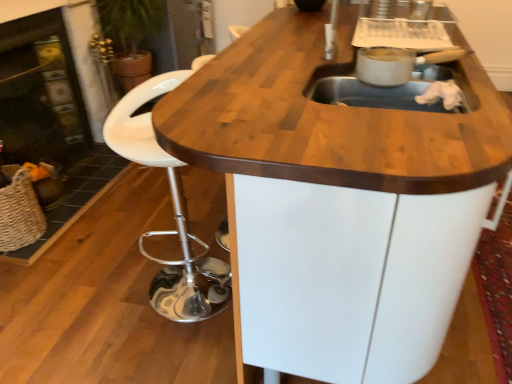
This screenshot has height=384, width=512. What do you see at coordinates (174, 211) in the screenshot?
I see `white plastic stool at lower left` at bounding box center [174, 211].

This screenshot has width=512, height=384. I want to click on woven straw basket at lower left, so click(19, 211).

This screenshot has height=384, width=512. I want to click on basket lying below the matte black fireplace at left, the 1th fireplace when ordered from left to right (from the image's perspective), so click(19, 211).

Consider the image. Is matte black fireplace at left, the 1th fireplace when ordered from left to right, facing towards woven straw basket at lower left?

No, matte black fireplace at left, the 1th fireplace when ordered from left to right, does not turn towards woven straw basket at lower left.

From their relative heights in the image, would you say matte black fireplace at left, the 1th fireplace when ordered from left to right, is taller or shorter than woven straw basket at lower left?

In the image, matte black fireplace at left, the 1th fireplace when ordered from left to right, appears to be taller than woven straw basket at lower left.

How different are the orientations of white plastic stool at lower left and woven straw basket at lower left in degrees?

The angular difference between white plastic stool at lower left and woven straw basket at lower left is 90 degrees.

Is white plastic stool at lower left bigger than woven straw basket at lower left?

Correct, white plastic stool at lower left is larger in size than woven straw basket at lower left.

Is point (199, 242) less distant than point (17, 216)?

No, it is behind (17, 216).

Is white plastic stool at lower left oriented away from woven straw basket at lower left?

No, white plastic stool at lower left is not facing the opposite direction of woven straw basket at lower left.

From the image's perspective, is white plastic stool at lower left over matte black fireplace at left, the 1th fireplace when ordered from left to right?

No, from the image's perspective, white plastic stool at lower left is not over matte black fireplace at left, the 1th fireplace when ordered from left to right.

Can you confirm if white plastic stool at lower left is thinner than matte black fireplace at left, the 1th fireplace when ordered from left to right?

No.

Which object is positioned more to the right, white plastic stool at lower left or matte black fireplace at left, the second fireplace viewed from the right?

→ From the viewer's perspective, white plastic stool at lower left appears more on the right side.

Would you say white plastic stool at lower left contains matte black fireplace at left, the second fireplace viewed from the right?

No, matte black fireplace at left, the second fireplace viewed from the right, is not surrounded by white plastic stool at lower left.

Considering the positions of point (172, 261) and point (60, 82), is point (172, 261) closer or farther from the camera than point (60, 82)?

Point (172, 261).

Which of these two, white plastic stool at lower left or black glass fireplace at left, positioned as the second fireplace in left-to-right order, stands shorter?

Standing shorter between the two is white plastic stool at lower left.

Find the location of `the 1st fireplace to the left when counting from the white plastic stool at lower left`. the 1st fireplace to the left when counting from the white plastic stool at lower left is located at coordinates (56, 111).

Which is behind, point (10, 209) or point (39, 149)?

Positioned behind is point (39, 149).

From the picture: Relative to matte black fireplace at left, the 1th fireplace when ordered from left to right, is woven straw basket at lower left in front or behind?

Clearly, woven straw basket at lower left is in front of matte black fireplace at left, the 1th fireplace when ordered from left to right.

Considering the relative sizes of woven straw basket at lower left and matte black fireplace at left, the second fireplace viewed from the right, in the image provided, is woven straw basket at lower left smaller than matte black fireplace at left, the second fireplace viewed from the right,?

Indeed, woven straw basket at lower left has a smaller size compared to matte black fireplace at left, the second fireplace viewed from the right.

Which of these two, woven straw basket at lower left or white plastic stool at lower left, stands taller?

white plastic stool at lower left is taller.

From a real-world perspective, between woven straw basket at lower left and white plastic stool at lower left, who is vertically lower?

From a 3D spatial view, woven straw basket at lower left is below.

Which point is more distant from viewer, (1,191) or (170,308)?

The point (1,191) is more distant.

Is woven straw basket at lower left further to the viewer compared to white plastic stool at lower left?

Yes.

Is black glass fireplace at left, positioned as the second fireplace in left-to-right order, not within matte black fireplace at left, the second fireplace viewed from the right?

Actually, black glass fireplace at left, positioned as the second fireplace in left-to-right order, is at least partially inside matte black fireplace at left, the second fireplace viewed from the right.

Are black glass fireplace at left, positioned as the second fireplace in left-to-right order, and matte black fireplace at left, the 1th fireplace when ordered from left to right, located far from each other?

No.

Is the depth of black glass fireplace at left, placed as the first fireplace when sorted from right to left, greater than that of matte black fireplace at left, the second fireplace viewed from the right?

No, black glass fireplace at left, placed as the first fireplace when sorted from right to left, is in front of matte black fireplace at left, the second fireplace viewed from the right.

Is point (91, 36) in front of point (71, 79)?

No, (91, 36) is further to viewer.

In the image, there is a matte black fireplace at left, the second fireplace viewed from the right. Where is `basket below it (from the image's perspective)`? basket below it (from the image's perspective) is located at coordinates (19, 211).

At what (x,y) coordinates should I click in order to perform the action: click on basket that appears below the white plastic stool at lower left (from a real-world perspective). Please return your answer as a coordinate pair (x, y). Looking at the image, I should click on (19, 211).

Estimate the real-world distances between objects in this image. Which object is closer to black glass fireplace at left, positioned as the second fireplace in left-to-right order, woven straw basket at lower left or matte black fireplace at left, the 1th fireplace when ordered from left to right?

A: matte black fireplace at left, the 1th fireplace when ordered from left to right.

Considering their positions, is matte black fireplace at left, the second fireplace viewed from the right, positioned closer to black glass fireplace at left, placed as the first fireplace when sorted from right to left, than white plastic stool at lower left?

matte black fireplace at left, the second fireplace viewed from the right.

Looking at the image, which one is located further to white plastic stool at lower left, woven straw basket at lower left or matte black fireplace at left, the second fireplace viewed from the right?

The object further to white plastic stool at lower left is matte black fireplace at left, the second fireplace viewed from the right.

Based on the photo, which object lies further to the anchor point white plastic stool at lower left, black glass fireplace at left, positioned as the second fireplace in left-to-right order, or woven straw basket at lower left?

black glass fireplace at left, positioned as the second fireplace in left-to-right order, is further to white plastic stool at lower left.

Based on their spatial positions, is black glass fireplace at left, placed as the first fireplace when sorted from right to left, or matte black fireplace at left, the 1th fireplace when ordered from left to right, closer to white plastic stool at lower left?

black glass fireplace at left, placed as the first fireplace when sorted from right to left, is closer to white plastic stool at lower left.

Estimate the real-world distances between objects in this image. Which object is closer to black glass fireplace at left, placed as the first fireplace when sorted from right to left, white plastic stool at lower left or matte black fireplace at left, the 1th fireplace when ordered from left to right?

matte black fireplace at left, the 1th fireplace when ordered from left to right, is positioned closer to the anchor black glass fireplace at left, placed as the first fireplace when sorted from right to left.

Looking at the image, which one is located further to woven straw basket at lower left, white plastic stool at lower left or matte black fireplace at left, the 1th fireplace when ordered from left to right?

The object further to woven straw basket at lower left is white plastic stool at lower left.

From the image, which object appears to be farther from black glass fireplace at left, positioned as the second fireplace in left-to-right order, white plastic stool at lower left or woven straw basket at lower left?

Based on the image, white plastic stool at lower left appears to be further to black glass fireplace at left, positioned as the second fireplace in left-to-right order.

At what (x,y) coordinates should I click in order to perform the action: click on fireplace situated between matte black fireplace at left, the second fireplace viewed from the right, and white plastic stool at lower left from left to right. Please return your answer as a coordinate pair (x, y). This screenshot has height=384, width=512. Looking at the image, I should click on (56, 111).

Where is `fireplace between black glass fireplace at left, positioned as the second fireplace in left-to-right order, and woven straw basket at lower left, in the vertical direction`? This screenshot has height=384, width=512. fireplace between black glass fireplace at left, positioned as the second fireplace in left-to-right order, and woven straw basket at lower left, in the vertical direction is located at coordinates (41, 93).

I want to click on basket situated between black glass fireplace at left, placed as the first fireplace when sorted from right to left, and white plastic stool at lower left from left to right, so click(x=19, y=211).

This screenshot has width=512, height=384. Identify the location of basket located between matte black fireplace at left, the 1th fireplace when ordered from left to right, and white plastic stool at lower left in the left-right direction. (19, 211).